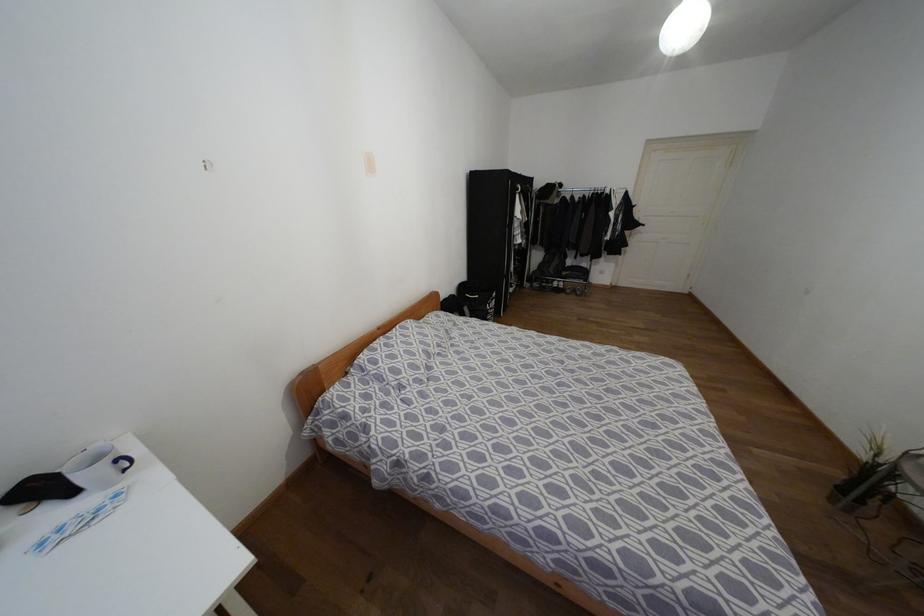
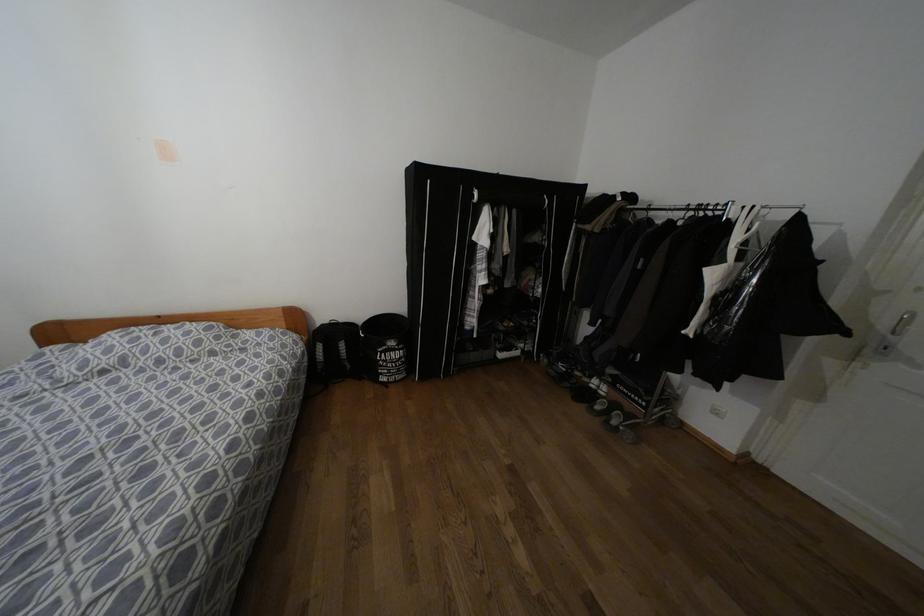
The point at (465, 309) is marked in the first image. Where is the corresponding point in the second image?

(342, 345)